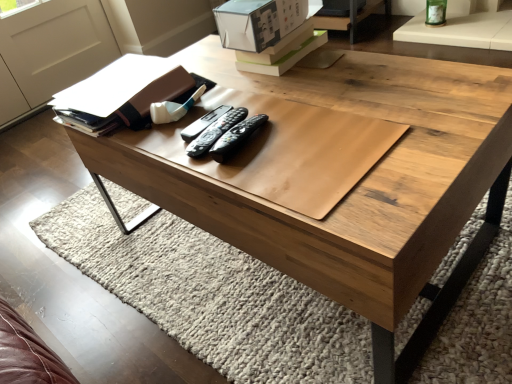
Locate an element on the screen. The width and height of the screenshot is (512, 384). free location to the left of black plastic remote at center, which ranks as the 2th remote in left-to-right order is located at coordinates (158, 148).